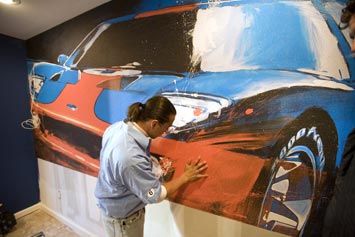
You are a GUI agent. You are given a task and a screenshot of the screen. Output one action in this format:
    pyautogui.click(x=<x>, y=<y>)
    Task: Click on the wall
    The image size is (355, 237).
    Given the screenshot: What is the action you would take?
    pyautogui.click(x=10, y=60)